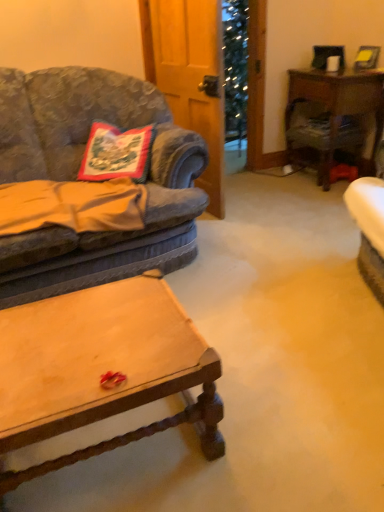
The width and height of the screenshot is (384, 512). I want to click on vacant area that lies to the right of velvet fabric couch at left, so click(279, 254).